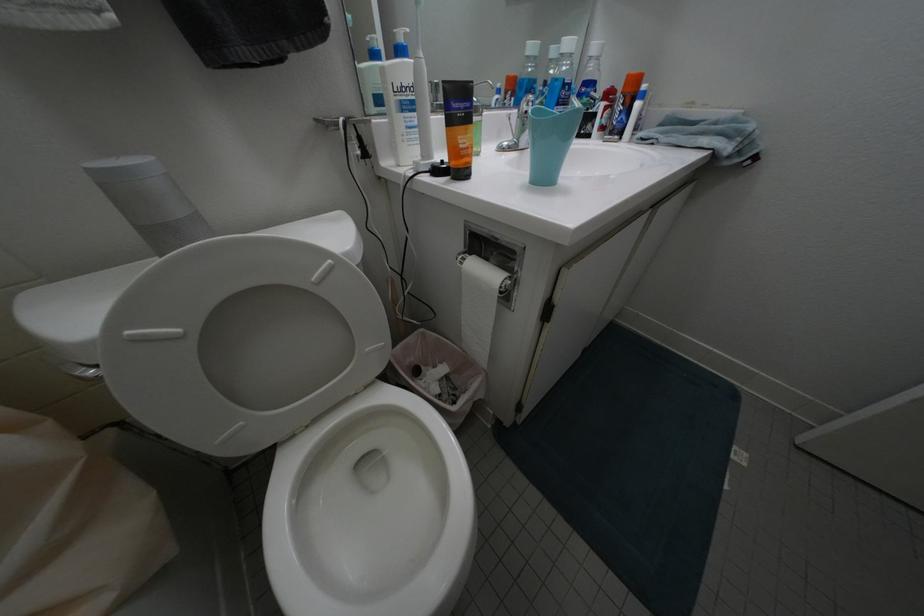
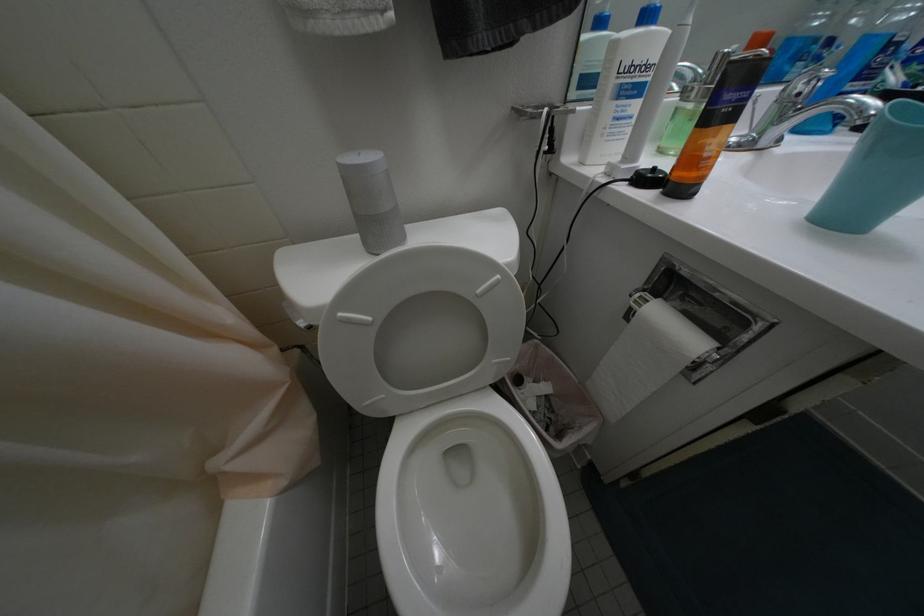
Question: How did the camera likely rotate?

Choices:
 (A) Left
 (B) Right
 (C) Up
 (D) Down

Answer: (A)